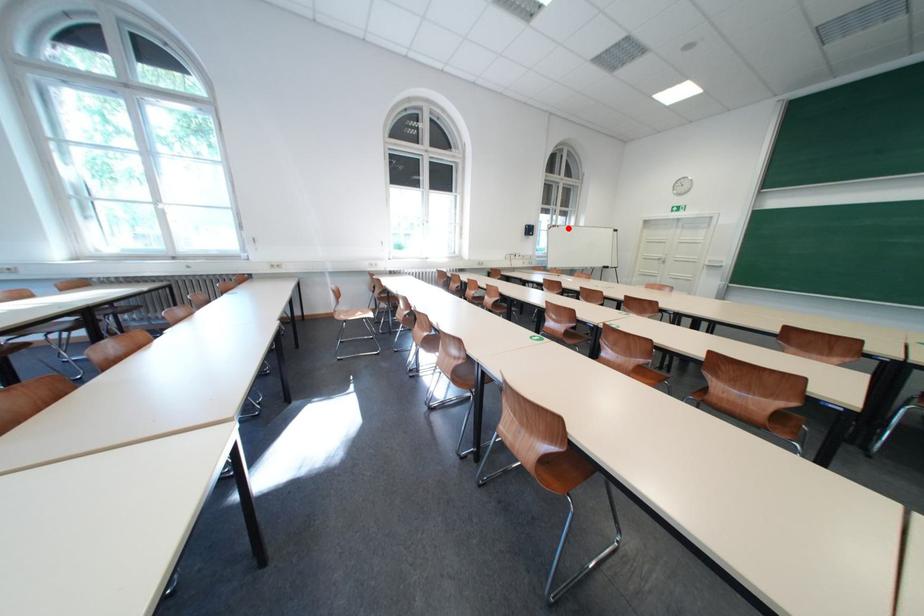
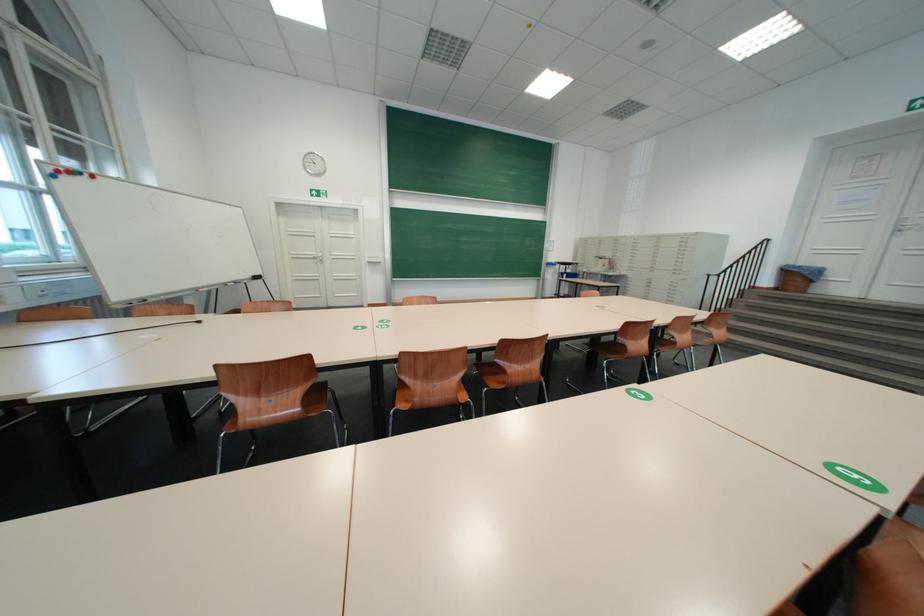
Where in the second image is the point corresponding to the highlighted location from the first image?

(88, 175)